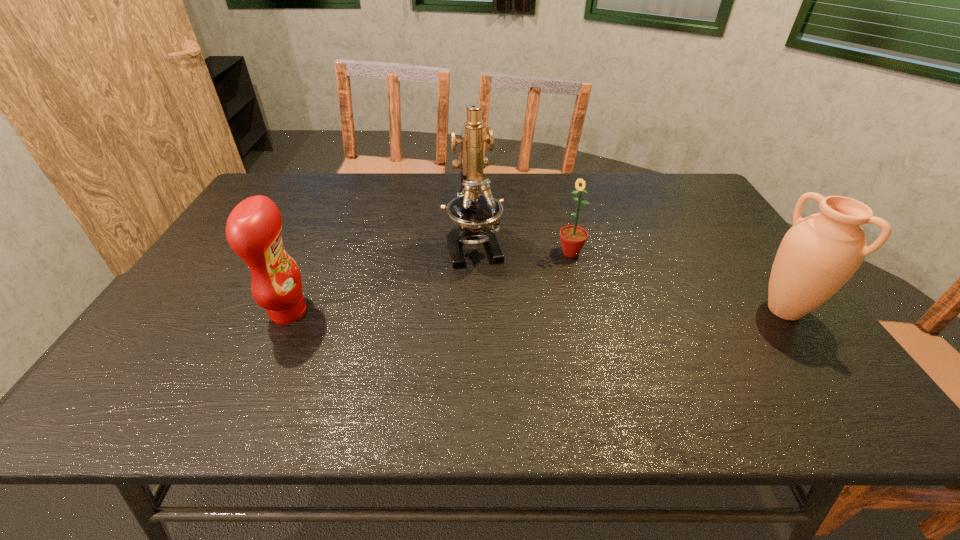
In order to click on vacant spot on the desktop that is between the condiment and the rightmost object and is positioned on the face of the third object from left to right in this screenshot , I will do `click(496, 312)`.

The width and height of the screenshot is (960, 540). Find the location of `vacant space on the desktop that is between the leftmost object and the rightmost object and is positioned at the eyepiece of the second object from left to right`. vacant space on the desktop that is between the leftmost object and the rightmost object and is positioned at the eyepiece of the second object from left to right is located at coordinates (494, 312).